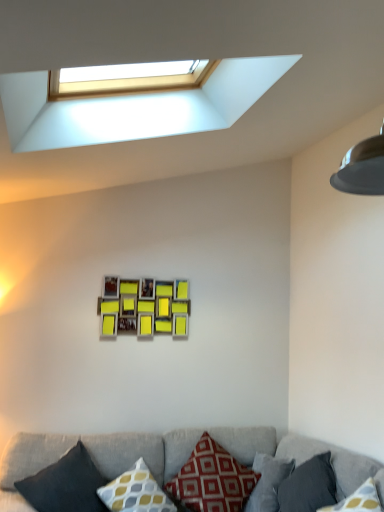
Question: Based on their sizes in the image, would you say yellow and gray patterned pillow at center, which appears as the 4th pillow when viewed from the right, is bigger or smaller than wooden photo frame at center?

Choices:
 (A) big
 (B) small

Answer: (A)

Question: Considering the positions of point (139, 501) and point (132, 326), is point (139, 501) closer or farther from the camera than point (132, 326)?

Choices:
 (A) closer
 (B) farther

Answer: (A)

Question: Which object is positioned closest to the red cotton pillow at center, which is counted as the third pillow, starting from the left?

Choices:
 (A) dark gray fabric pillow at lower right, which ranks as the 1th pillow in right-to-left order
 (B) dark gray fabric pillow at lower right, which is the 4th pillow in left-to-right order
 (C) white plastic window at upper center
 (D) wooden photo frame at center
 (E) yellow and gray patterned pillow at center, which ranks as the 2th pillow in left-to-right order

Answer: (E)

Question: Estimate the real-world distances between objects in this image. Which object is farther from the wooden photo frame at center?

Choices:
 (A) yellow and gray patterned pillow at center, which ranks as the 2th pillow in left-to-right order
 (B) dark gray fabric pillow at lower right, placed as the 2th pillow when sorted from right to left
 (C) textured gray couch at lower center
 (D) white plastic window at upper center
 (E) dark gray fabric pillow at lower left, which ranks as the 5th pillow in right-to-left order

Answer: (B)